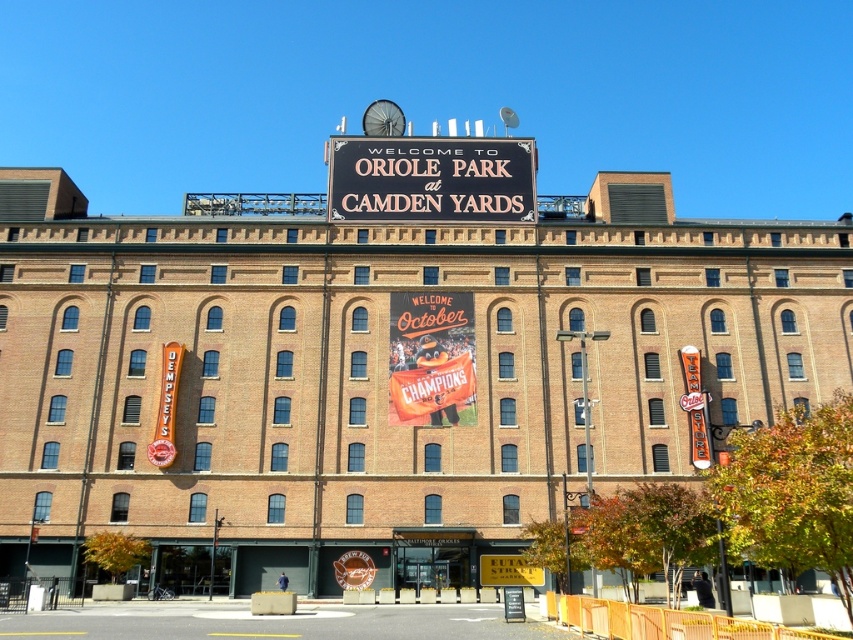
Is black matte sign at center to the right of orange fabric banner at center from the viewer's perspective?

Incorrect, black matte sign at center is not on the right side of orange fabric banner at center.

Is point (515, 172) in front of point (473, 413)?

No, (515, 172) is further to viewer.

Locate an element on the screen. The width and height of the screenshot is (853, 640). black matte sign at center is located at coordinates (431, 179).